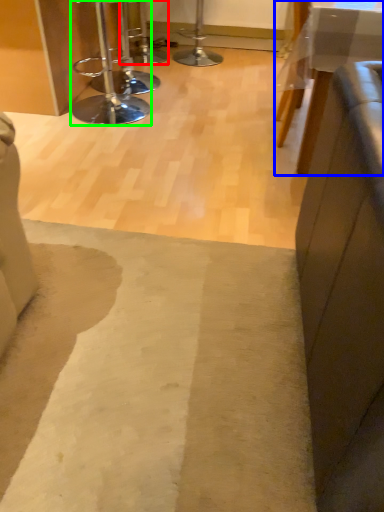
Question: Based on their relative distances, which object is nearer to bar stool (highlighted by a red box)? Choose from table (highlighted by a blue box) and stool (highlighted by a green box).

Choices:
 (A) table
 (B) stool

Answer: (B)